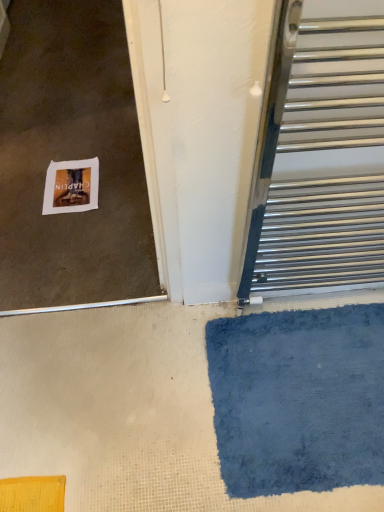
Where is `white paper at lower left`? The image size is (384, 512). white paper at lower left is located at coordinates (71, 186).

Is polished metal towel rack at right far away from white paper at lower left?

That's not correct — polished metal towel rack at right is a little close to white paper at lower left.

From a real-world perspective, is polished metal towel rack at right beneath white paper at lower left?

No, from a real-world perspective, polished metal towel rack at right is not under white paper at lower left.

Between polished metal towel rack at right and white paper at lower left, which one has smaller width?

With smaller width is polished metal towel rack at right.

Is polished metal towel rack at right taller than white paper at lower left?

Yes, polished metal towel rack at right is taller than white paper at lower left.

From a real-world perspective, is white paper at lower left beneath polished metal towel rack at right?

Yes, from a real-world perspective, white paper at lower left is under polished metal towel rack at right.

Which is more to the left, white paper at lower left or polished metal towel rack at right?

white paper at lower left.

Is white paper at lower left inside or outside of polished metal towel rack at right?

white paper at lower left is not enclosed by polished metal towel rack at right.

Consider the image. Can you confirm if white paper at lower left is wider than blue plush bath mat at lower right?

No.

Considering the positions of points (55, 211) and (330, 475), is point (55, 211) farther from camera compared to point (330, 475)?

Yes.

Between white paper at lower left and blue plush bath mat at lower right, which one appears on the left side from the viewer's perspective?

From the viewer's perspective, white paper at lower left appears more on the left side.

Which is nearer, (382, 480) or (90, 208)?

The point (382, 480) is closer to the camera.

Are blue plush bath mat at lower right and white paper at lower left located far from each other?

No, blue plush bath mat at lower right is in close proximity to white paper at lower left.

Considering the relative sizes of blue plush bath mat at lower right and white paper at lower left in the image provided, is blue plush bath mat at lower right shorter than white paper at lower left?

Incorrect, the height of blue plush bath mat at lower right does not fall short of that of white paper at lower left.

Can you confirm if blue plush bath mat at lower right is positioned to the left of white paper at lower left?

No.

Considering the sizes of polished metal towel rack at right and blue plush bath mat at lower right in the image, is polished metal towel rack at right taller or shorter than blue plush bath mat at lower right?

Considering their sizes, polished metal towel rack at right has more height than blue plush bath mat at lower right.

In terms of size, does polished metal towel rack at right appear bigger or smaller than blue plush bath mat at lower right?

In the image, polished metal towel rack at right appears to be larger than blue plush bath mat at lower right.

Looking at this image, is polished metal towel rack at right to the right of blue plush bath mat at lower right from the viewer's perspective?

Indeed, polished metal towel rack at right is positioned on the right side of blue plush bath mat at lower right.

I want to click on door located on the right of blue plush bath mat at lower right, so (317, 157).

Does blue plush bath mat at lower right lie behind polished metal towel rack at right?

Yes, blue plush bath mat at lower right is further from the viewer.

Between blue plush bath mat at lower right and polished metal towel rack at right, which one has more height?

polished metal towel rack at right is taller.

Find the location of a particular element. The width and height of the screenshot is (384, 512). postcard below the polished metal towel rack at right (from a real-world perspective) is located at coordinates (71, 186).

The image size is (384, 512). I want to click on postcard behind the polished metal towel rack at right, so click(x=71, y=186).

Considering their positions, is polished metal towel rack at right positioned closer to blue plush bath mat at lower right than white paper at lower left?

polished metal towel rack at right is positioned closer to the anchor blue plush bath mat at lower right.

Which object lies further to the anchor point white paper at lower left, blue plush bath mat at lower right or polished metal towel rack at right?

Among the two, blue plush bath mat at lower right is located further to white paper at lower left.

Looking at the image, which one is located closer to blue plush bath mat at lower right, white paper at lower left or polished metal towel rack at right?

Based on the image, polished metal towel rack at right appears to be nearer to blue plush bath mat at lower right.

Considering their positions, is blue plush bath mat at lower right positioned closer to polished metal towel rack at right than white paper at lower left?

blue plush bath mat at lower right lies closer to polished metal towel rack at right than the other object.

Which object lies further to the anchor point polished metal towel rack at right, white paper at lower left or blue plush bath mat at lower right?

The object further to polished metal towel rack at right is white paper at lower left.

Considering their positions, is polished metal towel rack at right positioned closer to white paper at lower left than blue plush bath mat at lower right?

Based on the image, polished metal towel rack at right appears to be nearer to white paper at lower left.

This screenshot has width=384, height=512. I want to click on bath mat located between polished metal towel rack at right and white paper at lower left in the depth direction, so click(x=298, y=399).